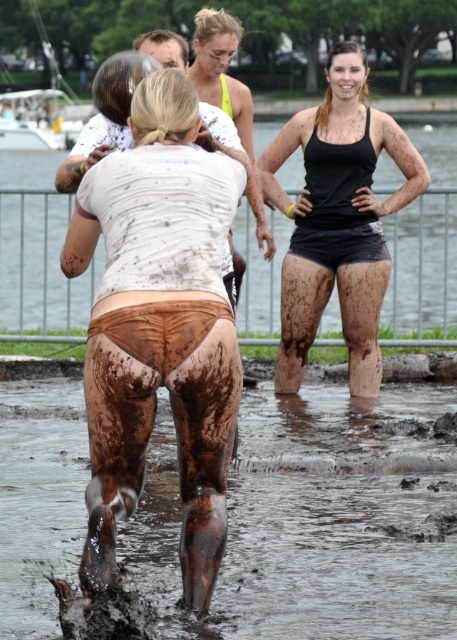
Looking at this image, you are a participant in the mud run event and want to avoid stepping into the muddy water at lower center. Based on the coordinates provided, which direction should you move to stay clear of it?

The muddy water at lower center is located at coordinates point (340,516). To avoid it, move away from that point, which would mean moving either north, south, east, or west depending on your current position relative to the point.

You are a photographer standing at the starting line of the mud run event. You want to capture a photo of the point at coordinates (138, 556). The camera you are using has a maximum focus range of 8 meters. Will your camera be able to focus on that point?

The distance between the point at coordinates (138, 556) and the viewer is 8.81 meters. Since the camera can only focus up to 8 meters, it will not be able to focus on the point at coordinates (138, 556).